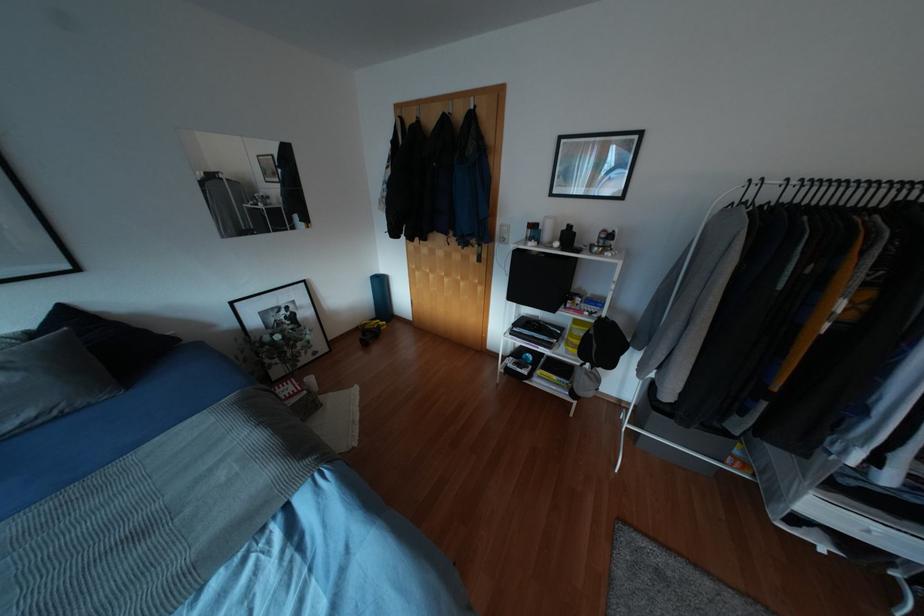
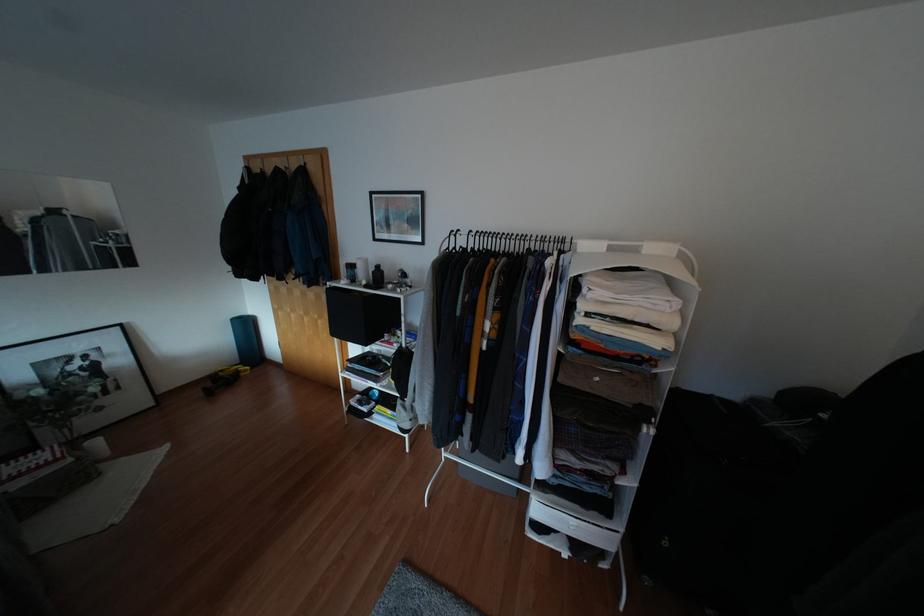
Where in the second image is the point corresponding to (x=310, y=379) from the first image?

(94, 442)